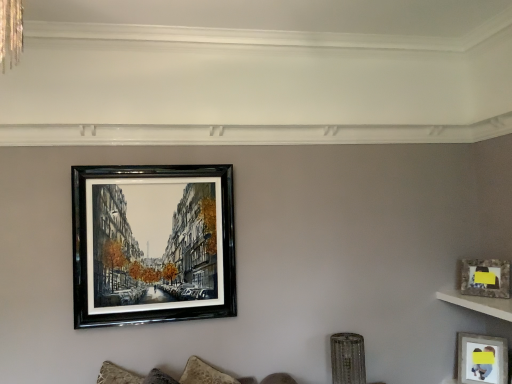
Question: Is point (122, 192) positioned closer to the camera than point (480, 307)?

Choices:
 (A) closer
 (B) farther

Answer: (A)

Question: Which is correct: black glossy picture frame at upper center, the 3th picture frame from the right, is inside white marble shelf at upper right, or outside of it?

Choices:
 (A) outside
 (B) inside

Answer: (A)

Question: Which object is positioned farthest from the matte glass picture frame at upper right, the 2th picture frame viewed from the top?

Choices:
 (A) white marble shelf at upper right
 (B) matte gray picture frame at lower right, which ranks as the 3th picture frame in top-to-bottom order
 (C) black glossy picture frame at upper center, the first picture frame from the top

Answer: (C)

Question: Which object is the closest to the black glossy picture frame at upper center, the first picture frame positioned from the left?

Choices:
 (A) matte glass picture frame at upper right, placed as the 2th picture frame when sorted from right to left
 (B) matte gray picture frame at lower right, the first picture frame viewed from the right
 (C) white marble shelf at upper right

Answer: (C)